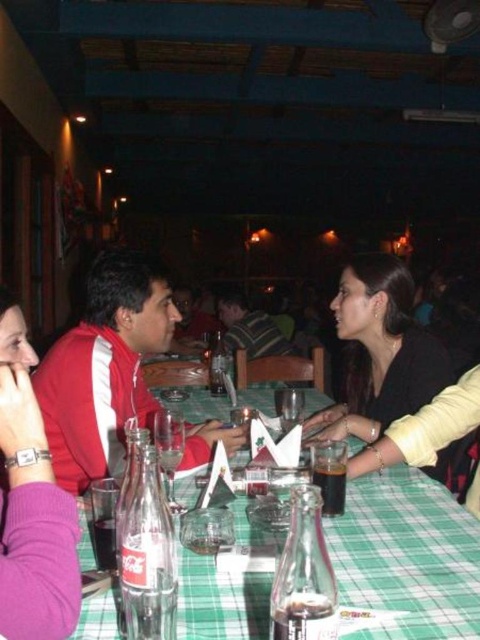
Question: Which point is farther to the camera?

Choices:
 (A) striped fabric shirt at center
 (B) red fabric jacket at center

Answer: (A)

Question: Observing the image, what is the correct spatial positioning of green checkered tablecloth at center in reference to red fabric jacket at center?

Choices:
 (A) below
 (B) above

Answer: (A)

Question: Does red fabric jacket at center have a larger size compared to striped fabric shirt at center?

Choices:
 (A) no
 (B) yes

Answer: (A)

Question: Which object is positioned closest to the black matte jacket at center?

Choices:
 (A) purple fabric shirt at left
 (B) red fabric jacket at center

Answer: (B)

Question: Where is red fabric jacket at center located in relation to purple fabric shirt at left in the image?

Choices:
 (A) above
 (B) below

Answer: (A)

Question: Which object is the closest to the purple fabric shirt at left?

Choices:
 (A) red fabric jacket at center
 (B) black matte jacket at center

Answer: (A)